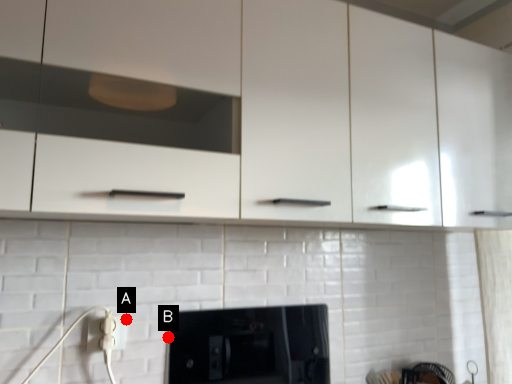
Question: Two points are circled on the image, labeled by A and B beside each circle. Which of the following is the farthest from the observer?

Choices:
 (A) A is further
 (B) B is further

Answer: (B)